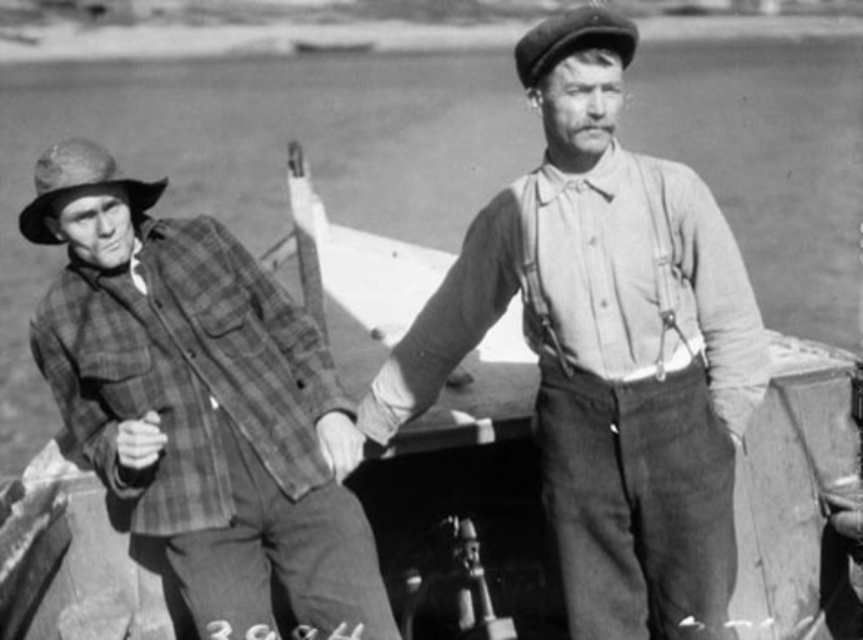
Question: Which of the following is the farthest from the observer?

Choices:
 (A) (269, 328)
 (B) (580, 56)

Answer: (A)

Question: Does smooth cotton shirt at center have a larger size compared to plaid fabric shirt at left?

Choices:
 (A) yes
 (B) no

Answer: (A)

Question: Can you confirm if smooth cotton shirt at center is smaller than plaid fabric shirt at left?

Choices:
 (A) yes
 (B) no

Answer: (B)

Question: Where is smooth cotton shirt at center located in relation to plaid fabric shirt at left in the image?

Choices:
 (A) above
 (B) below

Answer: (A)

Question: Which point is closer to the camera?

Choices:
 (A) smooth cotton shirt at center
 (B) plaid fabric shirt at left

Answer: (A)